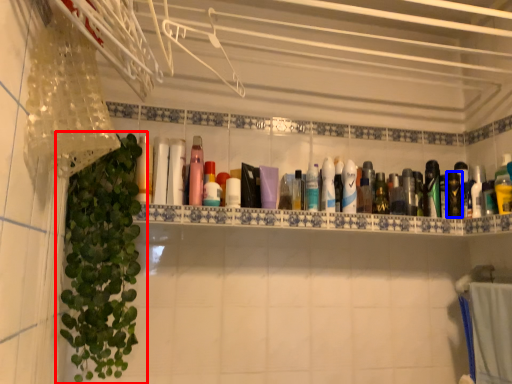
Question: Among these objects, which one is farthest to the camera, houseplant (highlighted by a red box) or mouthwash (highlighted by a blue box)?

Choices:
 (A) houseplant
 (B) mouthwash

Answer: (B)